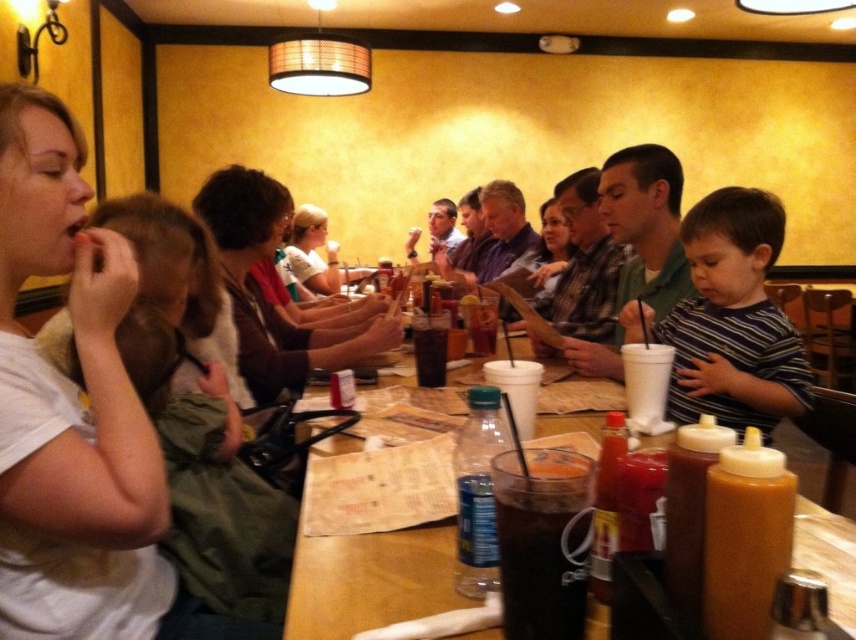
You are a waiter at the restaurant and need to deliver a drink to the customer wearing the matte brown shirt at center. The drink is in the translucent glass cup at table center. Can you place the drink directly in front of the customer without moving anything else on the table?

The matte brown shirt at center is above the translucent glass cup at table center, meaning the shirt is worn by the customer sitting over the cup. Therefore, you cannot place the drink directly in front of the customer without moving the shirt, which isn

In the scene shown: You are a photographer taking a picture of the striped cotton shirt at center and the matte white shirt at center. Which shirt should you focus on first if you want to capture both shirts clearly in the same frame?

The striped cotton shirt at center is below the matte white shirt at center, so you should focus on the matte white shirt at center first to ensure both shirts are in focus.